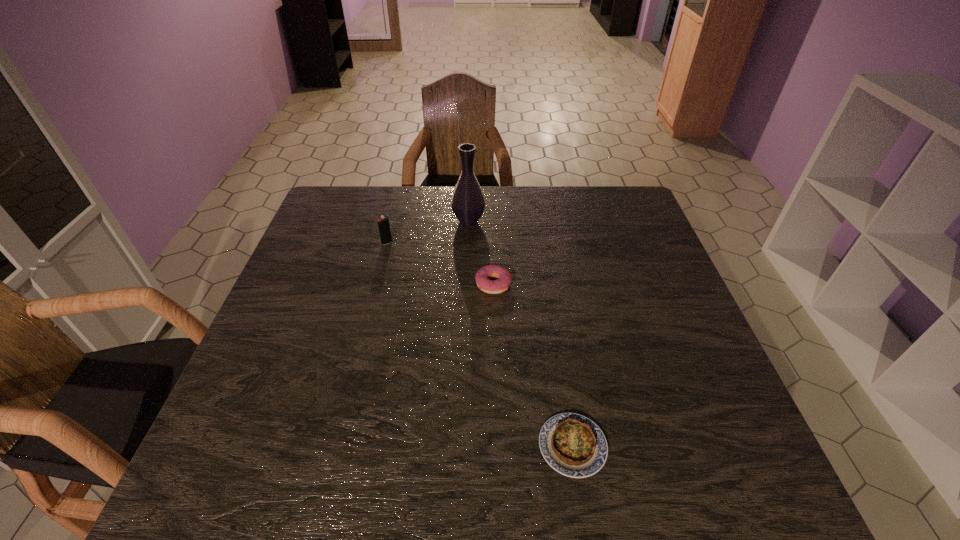
I want to click on vacant space in between the farthest object and the second farthest object, so click(428, 232).

At what (x,y) coordinates should I click in order to perform the action: click on free space between the tallest object and the third farthest object. Please return your answer as a coordinate pair (x, y). Looking at the image, I should click on (481, 253).

Where is `free space between the third tallest object and the vase`? free space between the third tallest object and the vase is located at coordinates tap(481, 253).

You are a GUI agent. You are given a task and a screenshot of the screen. Output one action in this format:
    pyautogui.click(x=<x>, y=<y>)
    Task: Click on the vacant space in between the tallest object and the third nearest object
    
    Given the screenshot: What is the action you would take?
    pyautogui.click(x=428, y=232)

Locate an element on the screen. This screenshot has height=540, width=960. free spot between the third nearest object and the second nearest object is located at coordinates (441, 264).

Find the location of a particular element. Image resolution: width=960 pixels, height=540 pixels. free space that is in between the tallest object and the quiche is located at coordinates (520, 334).

At what (x,y) coordinates should I click in order to perform the action: click on vacant space in between the leftmost object and the farthest object. Please return your answer as a coordinate pair (x, y). Image resolution: width=960 pixels, height=540 pixels. Looking at the image, I should click on (428, 232).

At what (x,y) coordinates should I click in order to perform the action: click on empty space that is in between the second tallest object and the vase. Please return your answer as a coordinate pair (x, y). This screenshot has width=960, height=540. Looking at the image, I should click on [428, 232].

Identify the location of vacant area that lies between the nearest object and the farthest object. Image resolution: width=960 pixels, height=540 pixels. (520, 334).

This screenshot has width=960, height=540. What are the coordinates of `empty space between the shortest object and the third tallest object` in the screenshot? It's located at (533, 365).